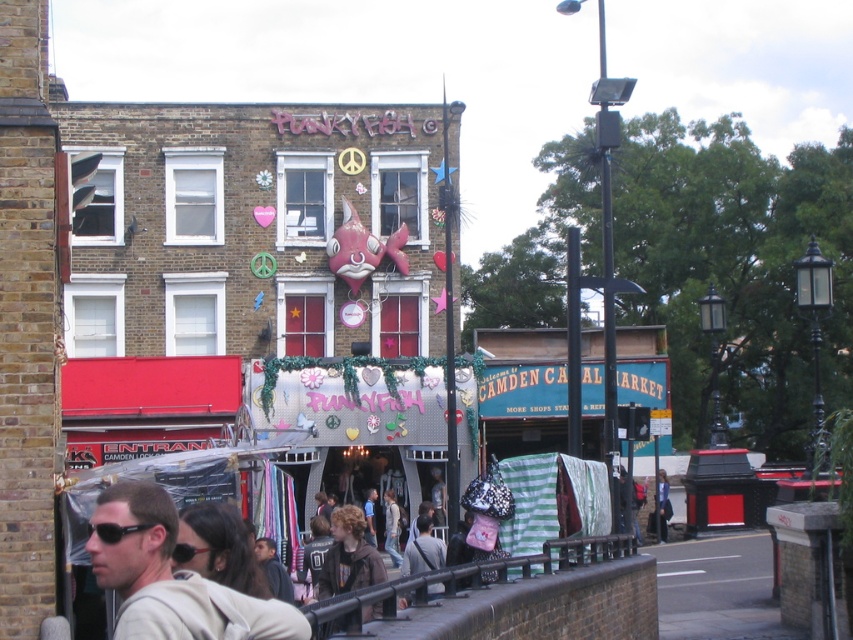
Question: Which point is farther from the camera taking this photo?

Choices:
 (A) (206, 552)
 (B) (171, 586)
 (C) (132, 525)
 (D) (647, 636)

Answer: (D)

Question: Where is black plastic sunglasses at lower left located in relation to black plastic goggles at lower left in the image?

Choices:
 (A) above
 (B) below

Answer: (B)

Question: Is black metal railing at lower center positioned before matte gray hoodie at lower left?

Choices:
 (A) no
 (B) yes

Answer: (A)

Question: Can you confirm if matte gray hoodie at lower left is bigger than black plastic goggles at lower left?

Choices:
 (A) yes
 (B) no

Answer: (A)

Question: Which point is closer to the camera?

Choices:
 (A) (212, 611)
 (B) (198, 552)

Answer: (A)

Question: Which point is closer to the camera?

Choices:
 (A) (115, 536)
 (B) (207, 548)

Answer: (A)